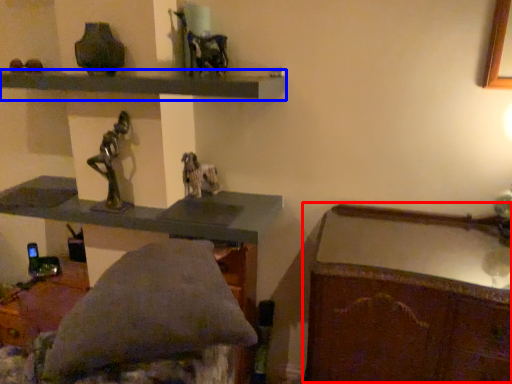
Question: Which object appears farthest to the camera in this image, writing desk (highlighted by a red box) or shelf (highlighted by a blue box)?

Choices:
 (A) writing desk
 (B) shelf

Answer: (B)